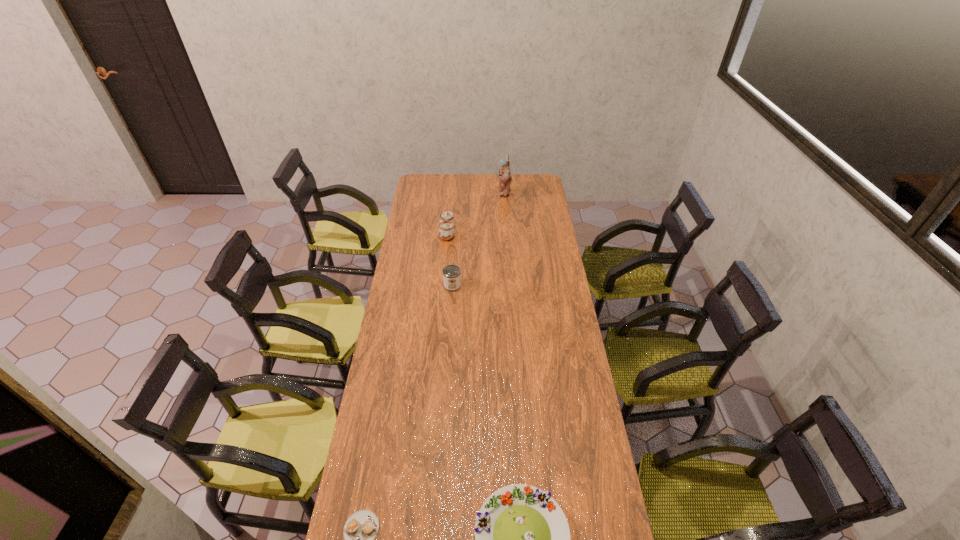
This screenshot has width=960, height=540. In order to click on the tallest object in this screenshot , I will do `click(505, 177)`.

Find the location of a particular element. figurine is located at coordinates (505, 177).

You are a GUI agent. You are given a task and a screenshot of the screen. Output one action in this format:
    pyautogui.click(x=<x>, y=<y>)
    Task: Click on the fourth shortest object
    This screenshot has height=540, width=960.
    Given the screenshot: What is the action you would take?
    pyautogui.click(x=446, y=231)

Where is `the fourth nearest object`? This screenshot has height=540, width=960. the fourth nearest object is located at coordinates (446, 231).

Where is `can`? can is located at coordinates (452, 273).

Find the location of a particular element. This screenshot has width=960, height=540. the third shortest object is located at coordinates (452, 273).

Identify the location of vacant area situated on the front-facing side of the tallest object. The height and width of the screenshot is (540, 960). (440, 192).

Find the location of a particular element. The image size is (960, 540). free location located 0.230m on the front-facing side of the tallest object is located at coordinates (463, 192).

The width and height of the screenshot is (960, 540). I want to click on free space located 0.110m on the front-facing side of the tallest object, so click(x=481, y=192).

Locate an element on the screen. vacant space located 0.170m by the handle of the second tallest object is located at coordinates (485, 233).